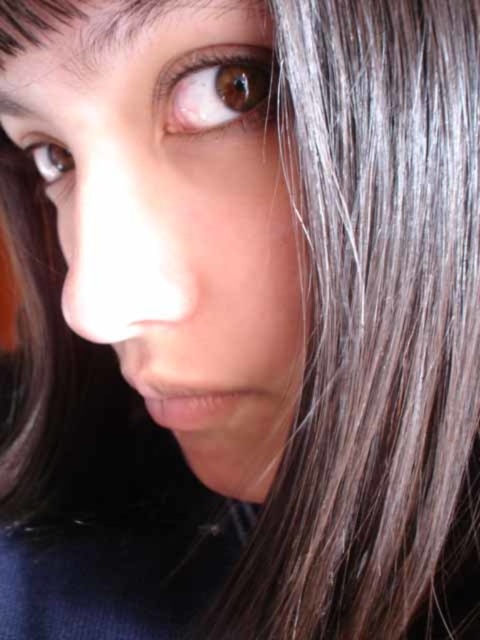
Who is positioned more to the left, brown matte eye at upper center or brown glossy eye at upper left?

From the viewer's perspective, brown glossy eye at upper left appears more on the left side.

Which is more to the right, brown matte eye at upper center or brown glossy eye at upper left?

brown matte eye at upper center

Is point (202, 100) farther from camera compared to point (35, 154)?

No, it is in front of (35, 154).

This screenshot has height=640, width=480. I want to click on brown matte eye at upper center, so click(x=218, y=90).